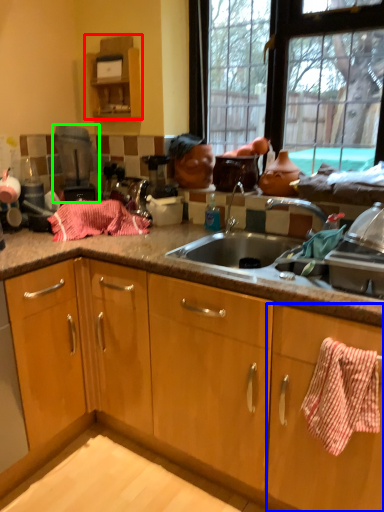
Question: Estimate the real-world distances between objects in this image. Which object is closer to cabinetry (highlighted by a red box), cabinetry (highlighted by a blue box) or appliance (highlighted by a green box)?

Choices:
 (A) cabinetry
 (B) appliance

Answer: (B)